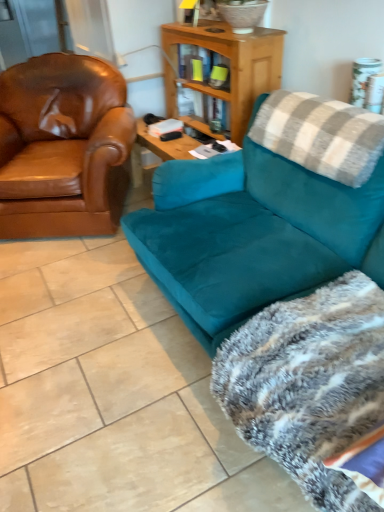
Question: Considering the relative sizes of fluffy gray blanket at lower right and gray plaid pillow at upper right in the image provided, is fluffy gray blanket at lower right bigger than gray plaid pillow at upper right?

Choices:
 (A) no
 (B) yes

Answer: (B)

Question: Is fluffy gray blanket at lower right taller than gray plaid pillow at upper right?

Choices:
 (A) yes
 (B) no

Answer: (A)

Question: Is gray plaid pillow at upper right at the back of fluffy gray blanket at lower right?

Choices:
 (A) no
 (B) yes

Answer: (A)

Question: Considering the relative sizes of fluffy gray blanket at lower right and gray plaid pillow at upper right in the image provided, is fluffy gray blanket at lower right shorter than gray plaid pillow at upper right?

Choices:
 (A) no
 (B) yes

Answer: (A)

Question: Would you say gray plaid pillow at upper right is part of fluffy gray blanket at lower right's contents?

Choices:
 (A) no
 (B) yes

Answer: (A)

Question: Is fluffy gray blanket at lower right wider or thinner than teal suede couch at right?

Choices:
 (A) thin
 (B) wide

Answer: (A)

Question: Looking at the image, does fluffy gray blanket at lower right seem bigger or smaller compared to teal suede couch at right?

Choices:
 (A) small
 (B) big

Answer: (A)

Question: Do you think fluffy gray blanket at lower right is within teal suede couch at right, or outside of it?

Choices:
 (A) inside
 (B) outside

Answer: (A)

Question: Is fluffy gray blanket at lower right to the left or to the right of teal suede couch at right in the image?

Choices:
 (A) right
 (B) left

Answer: (A)

Question: Which is correct: teal suede couch at right is inside fluffy gray blanket at lower right, or outside of it?

Choices:
 (A) outside
 (B) inside

Answer: (A)

Question: From the image's perspective, relative to fluffy gray blanket at lower right, is teal suede couch at right above or below?

Choices:
 (A) above
 (B) below

Answer: (A)

Question: Considering the positions of point (369, 205) and point (279, 352), is point (369, 205) closer or farther from the camera than point (279, 352)?

Choices:
 (A) farther
 (B) closer

Answer: (A)

Question: Considering the positions of teal suede couch at right and fluffy gray blanket at lower right in the image, is teal suede couch at right bigger or smaller than fluffy gray blanket at lower right?

Choices:
 (A) big
 (B) small

Answer: (A)

Question: In terms of width, does brown leather armchair at left look wider or thinner when compared to teal suede couch at right?

Choices:
 (A) wide
 (B) thin

Answer: (B)

Question: From a real-world perspective, relative to teal suede couch at right, is brown leather armchair at left vertically above or below?

Choices:
 (A) above
 (B) below

Answer: (A)